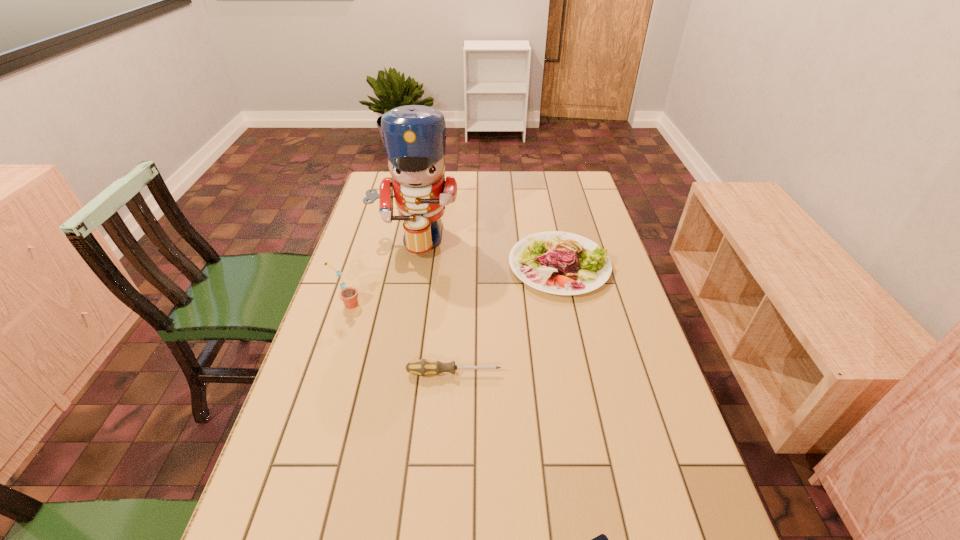
Where is `sunflower that is at the left edge`? This screenshot has width=960, height=540. sunflower that is at the left edge is located at coordinates (348, 295).

The image size is (960, 540). Identify the location of object located in the right edge section of the desktop. (556, 262).

Find the location of a particular element. free space at the far edge of the desktop is located at coordinates (477, 190).

This screenshot has height=540, width=960. In the image, there is a desktop. Find the location of `vacant space at the left edge`. vacant space at the left edge is located at coordinates (313, 362).

Where is `vacant space at the right edge of the desktop`? The height and width of the screenshot is (540, 960). vacant space at the right edge of the desktop is located at coordinates (592, 300).

The height and width of the screenshot is (540, 960). I want to click on free space at the far right corner, so click(563, 188).

The width and height of the screenshot is (960, 540). What are the coordinates of `free space between the third shortest object and the sunflower` in the screenshot? It's located at (453, 285).

Where is `unoccupied area between the second shortest object and the fourth shortest object`? unoccupied area between the second shortest object and the fourth shortest object is located at coordinates (400, 339).

Locate an element on the screen. Image resolution: width=960 pixels, height=540 pixels. free spot between the fourth shortest object and the salad plate is located at coordinates (453, 285).

The image size is (960, 540). In order to click on vacant point located between the second shortest object and the second tallest object in this screenshot , I will do tap(400, 339).